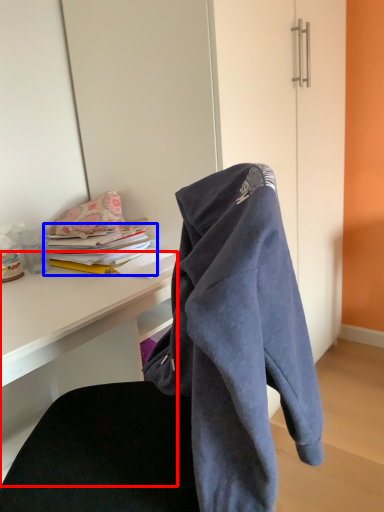
Question: Which object appears farthest to the camera in this image, desk (highlighted by a red box) or book (highlighted by a blue box)?

Choices:
 (A) desk
 (B) book

Answer: (B)